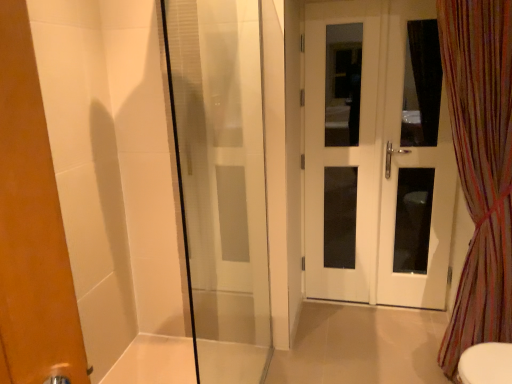
Question: Is white glass door at right, the 1th screen door positioned from the right, aimed at multicolored striped curtain at right?

Choices:
 (A) yes
 (B) no

Answer: (A)

Question: Is white glass door at right, the 1th screen door positioned from the right, wider than multicolored striped curtain at right?

Choices:
 (A) yes
 (B) no

Answer: (B)

Question: From a real-world perspective, is white glass door at right, which ranks as the second screen door in left-to-right order, under multicolored striped curtain at right?

Choices:
 (A) no
 (B) yes

Answer: (A)

Question: From the image's perspective, does white glass door at right, which ranks as the second screen door in left-to-right order, appear higher than multicolored striped curtain at right?

Choices:
 (A) no
 (B) yes

Answer: (B)

Question: Does white glass door at right, which ranks as the second screen door in left-to-right order, have a lesser width compared to multicolored striped curtain at right?

Choices:
 (A) yes
 (B) no

Answer: (A)

Question: Based on their positions, is white glass door at right, the 1th screen door positioned from the right, located to the left or right of white glossy door at center, the second screen door positioned from the right?

Choices:
 (A) right
 (B) left

Answer: (A)

Question: Do you think white glass door at right, which ranks as the second screen door in left-to-right order, is within white glossy door at center, the second screen door positioned from the right, or outside of it?

Choices:
 (A) outside
 (B) inside

Answer: (A)

Question: Is point (381, 226) closer or farther from the camera than point (307, 6)?

Choices:
 (A) farther
 (B) closer

Answer: (A)

Question: From their relative heights in the image, would you say white glass door at right, which ranks as the second screen door in left-to-right order, is taller or shorter than white glossy door at center, the second screen door positioned from the right?

Choices:
 (A) short
 (B) tall

Answer: (A)

Question: Would you say multicolored striped curtain at right is to the left or to the right of white glossy door at right in the picture?

Choices:
 (A) left
 (B) right

Answer: (B)

Question: In the image, is multicolored striped curtain at right positioned in front of or behind white glossy door at right?

Choices:
 (A) front
 (B) behind

Answer: (A)

Question: Considering the positions of multicolored striped curtain at right and white glossy door at right in the image, is multicolored striped curtain at right bigger or smaller than white glossy door at right?

Choices:
 (A) big
 (B) small

Answer: (A)

Question: Is multicolored striped curtain at right taller or shorter than white glossy door at right?

Choices:
 (A) tall
 (B) short

Answer: (B)

Question: Considering their positions, is white glass door at right, the 1th screen door positioned from the right, located in front of or behind transparent glass shower door at left?

Choices:
 (A) behind
 (B) front

Answer: (A)

Question: From the image's perspective, is white glass door at right, the 1th screen door positioned from the right, located above or below transparent glass shower door at left?

Choices:
 (A) below
 (B) above

Answer: (B)